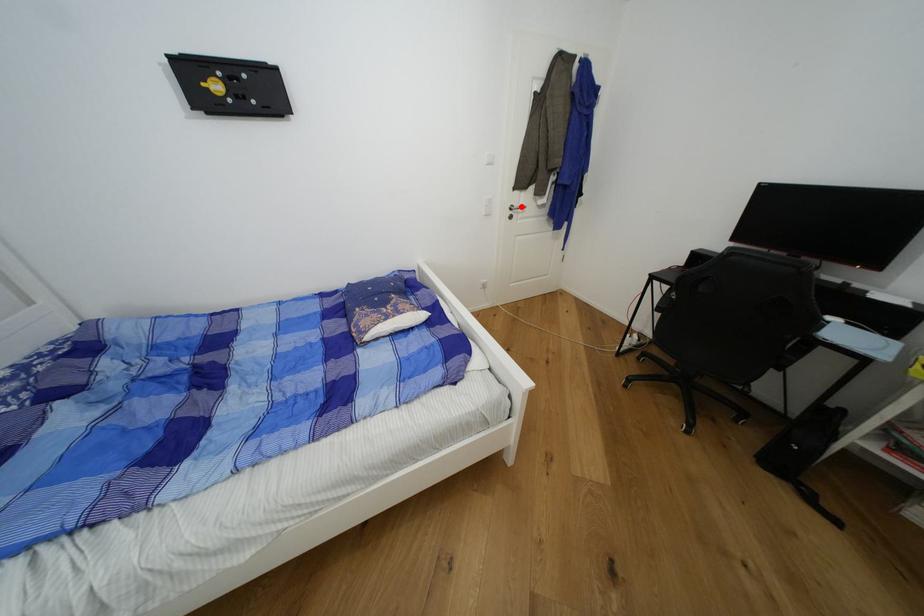
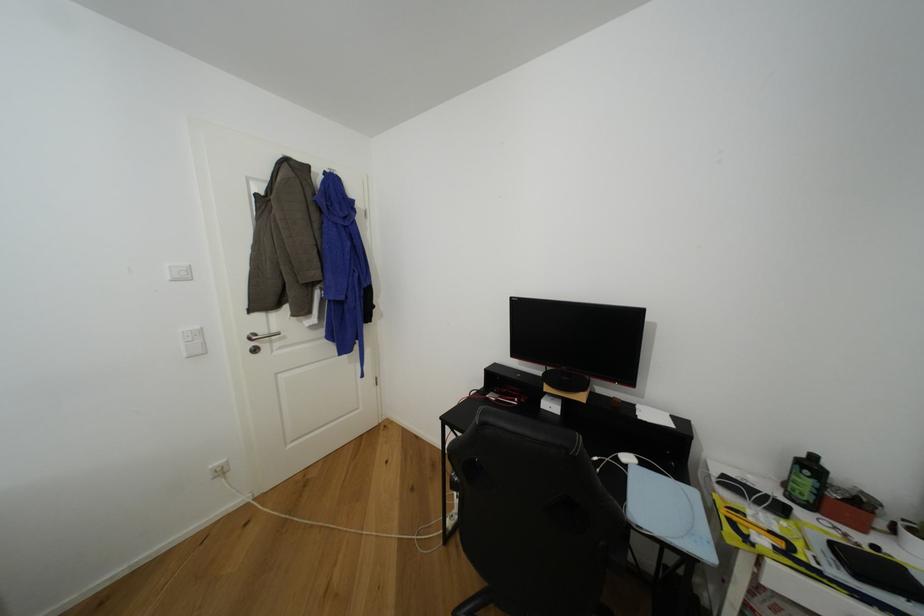
Where in the second image is the point corresponding to the highlighted location from the first image?

(268, 334)